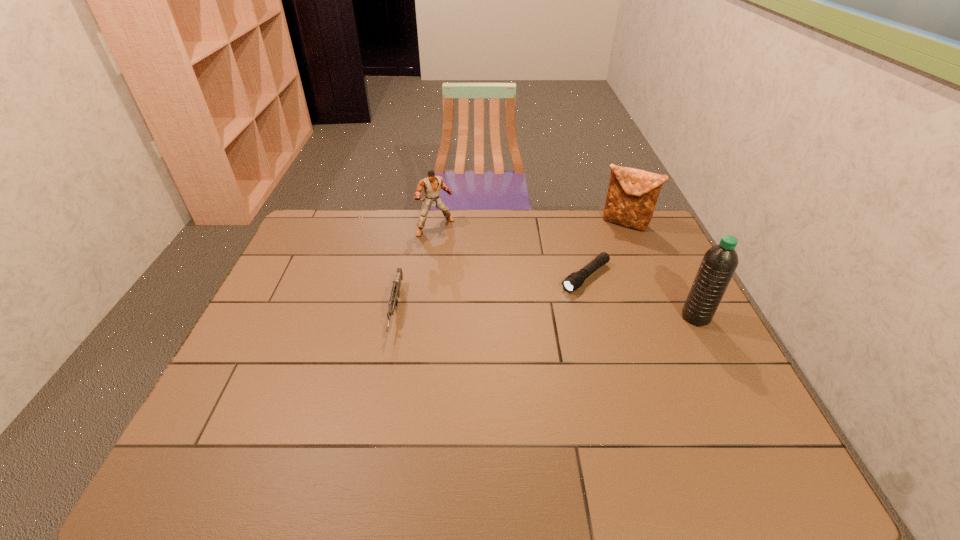
What are the coordinates of `the leftmost object` in the screenshot? It's located at (393, 301).

At what (x,y) coordinates should I click in order to perform the action: click on gun. Please return your answer as a coordinate pair (x, y). Image resolution: width=960 pixels, height=540 pixels. Looking at the image, I should click on (393, 301).

The image size is (960, 540). Find the location of `the tallest object`. the tallest object is located at coordinates (719, 263).

The height and width of the screenshot is (540, 960). What are the coordinates of `flashlight` in the screenshot? It's located at tap(575, 280).

Locate an element on the screen. The width and height of the screenshot is (960, 540). the shortest object is located at coordinates (575, 280).

Locate an element on the screen. This screenshot has height=540, width=960. the fourth object from right to left is located at coordinates (431, 184).

The height and width of the screenshot is (540, 960). Identify the location of clutch bag. 632,195.

You are a GUI agent. You are given a task and a screenshot of the screen. Output one action in this format:
    pyautogui.click(x=<x>, y=<y>)
    Task: Click on the vacant space located 0.130m aimed along the barrel of the gun
    
    Given the screenshot: What is the action you would take?
    pyautogui.click(x=381, y=382)

This screenshot has height=540, width=960. In order to click on vacant space located 0.290m on the front of the water bottle in this screenshot , I will do `click(749, 421)`.

Locate an element on the screen. The height and width of the screenshot is (540, 960). vacant space located at the lens end of the third object from right to left is located at coordinates (548, 307).